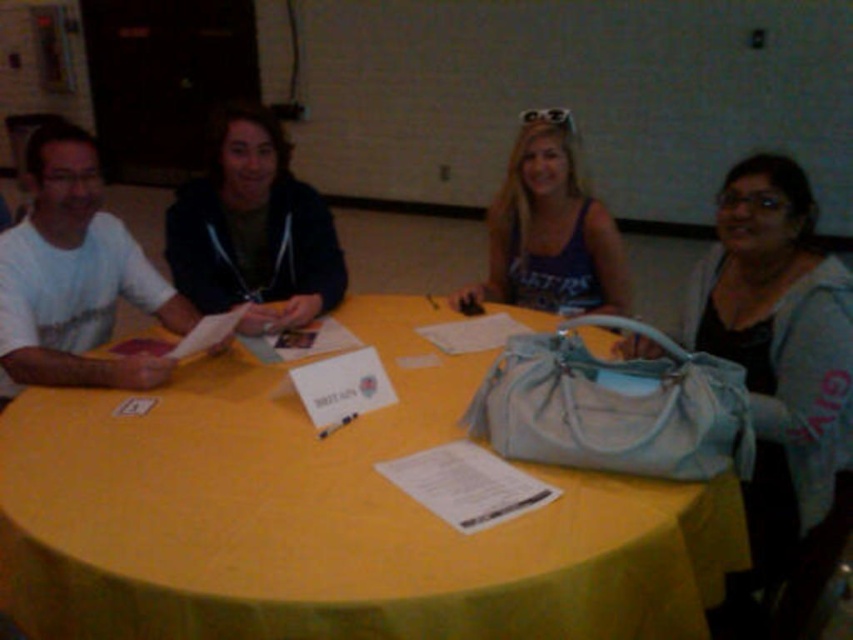
Who is positioned more to the right, matte blue purse at right or matte purple tank top at center?

matte blue purse at right is more to the right.

Who is more distant from viewer, (726, 221) or (567, 152)?

Positioned behind is point (567, 152).

Is point (795, 556) in front of point (549, 176)?

Yes, it is in front of point (549, 176).

Locate an element on the screen. This screenshot has width=853, height=640. matte blue purse at right is located at coordinates (780, 385).

Does yellow fabric table at center have a greater height compared to matte blue purse at right?

Incorrect, yellow fabric table at center's height is not larger of matte blue purse at right's.

Can you confirm if yellow fabric table at center is positioned below matte blue purse at right?

Yes.

Between point (712, 593) and point (825, 288), which one is positioned in front?

Point (712, 593) is in front.

Locate an element on the screen. This screenshot has width=853, height=640. yellow fabric table at center is located at coordinates click(x=328, y=516).

Who is positioned more to the left, matte black hoodie at center or matte purple tank top at center?

Positioned to the left is matte black hoodie at center.

Is matte black hoodie at center shorter than matte purple tank top at center?

In fact, matte black hoodie at center may be taller than matte purple tank top at center.

Where is `matte black hoodie at center`? matte black hoodie at center is located at coordinates (253, 228).

Identify the location of matte black hoodie at center. (253, 228).